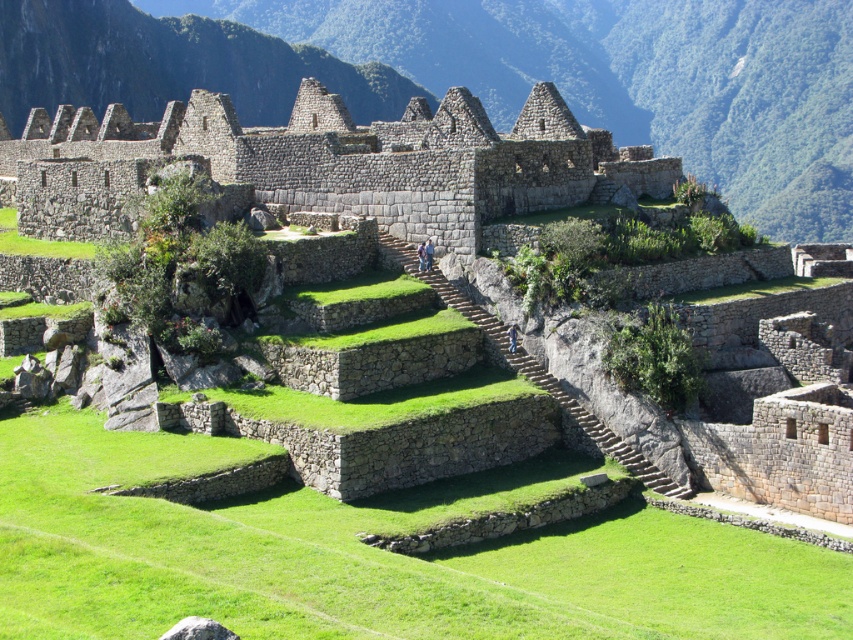
Question: Does natural stone ruins at center have a lesser width compared to gray stone ruins at center?

Choices:
 (A) yes
 (B) no

Answer: (B)

Question: Can you confirm if natural stone ruins at center is thinner than gray stone ruins at center?

Choices:
 (A) yes
 (B) no

Answer: (B)

Question: Can you confirm if natural stone ruins at center is positioned above gray stone ruins at center?

Choices:
 (A) no
 (B) yes

Answer: (B)

Question: Among these points, which one is nearest to the camera?

Choices:
 (A) (654, 6)
 (B) (593, 140)

Answer: (B)